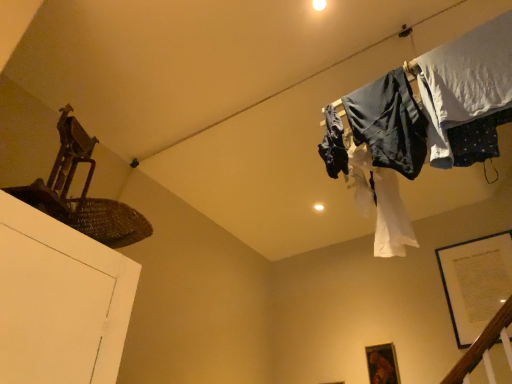
How much space does dark blue fabric at upper right, the second clothing when ordered from right to left, occupy horizontally?

dark blue fabric at upper right, the second clothing when ordered from right to left, is 4.74 inches in width.

Where is `dark blue fabric at upper right, the 2th clothing positioned from the left`? dark blue fabric at upper right, the 2th clothing positioned from the left is located at coordinates (389, 123).

What do you see at coordinates (333, 144) in the screenshot? I see `dark blue fabric at upper right, acting as the first clothing starting from the left` at bounding box center [333, 144].

The width and height of the screenshot is (512, 384). What do you see at coordinates (467, 81) in the screenshot?
I see `white fabric at upper right, arranged as the first clothing when viewed from the right` at bounding box center [467, 81].

Identify the location of dark blue fabric at upper right, the second clothing when ordered from right to left. The height and width of the screenshot is (384, 512). (389, 123).

Is dark blue fabric at upper right, acting as the first clothing starting from the left, surrounded by wooden frame at lower right?

Actually, dark blue fabric at upper right, acting as the first clothing starting from the left, is outside wooden frame at lower right.

Locate an element on the screen. The height and width of the screenshot is (384, 512). picture frame below the dark blue fabric at upper right, acting as the first clothing starting from the left (from a real-world perspective) is located at coordinates (382, 364).

Between wooden frame at lower right and dark blue fabric at upper right, acting as the first clothing starting from the left, which one has more height?

wooden frame at lower right.

Is there a large distance between wooden frame at lower right and dark blue fabric at upper right, acting as the first clothing starting from the left?

That's right, there is a large distance between wooden frame at lower right and dark blue fabric at upper right, acting as the first clothing starting from the left.

Does wooden frame at lower right appear on the left side of white fabric at upper right, arranged as the first clothing when viewed from the right?

Incorrect, wooden frame at lower right is not on the left side of white fabric at upper right, arranged as the first clothing when viewed from the right.

Is wooden frame at lower right shorter than white fabric at upper right, arranged as the first clothing when viewed from the right?

Indeed, wooden frame at lower right has a lesser height compared to white fabric at upper right, arranged as the first clothing when viewed from the right.

Between wooden frame at lower right and white fabric at upper right, arranged as the first clothing when viewed from the right, which one has smaller size?

With smaller size is wooden frame at lower right.

Does wooden frame at lower right come behind white fabric at upper right, arranged as the first clothing when viewed from the right?

Yes, wooden frame at lower right is behind white fabric at upper right, arranged as the first clothing when viewed from the right.

Is dark blue fabric at upper right, the second clothing when ordered from right to left, smaller than wooden frame at lower right?

Incorrect, dark blue fabric at upper right, the second clothing when ordered from right to left, is not smaller in size than wooden frame at lower right.

Is point (369, 110) closer to viewer compared to point (386, 373)?

That is True.

From a real-world perspective, which is physically above, dark blue fabric at upper right, the 2th clothing positioned from the left, or wooden frame at lower right?

In real-world perspective, dark blue fabric at upper right, the 2th clothing positioned from the left, is above.

How many degrees apart are the facing directions of dark blue fabric at upper right, the second clothing when ordered from right to left, and wooden frame at lower right?

They differ by 0.533 degrees in their facing directions.

Looking at this image, considering the relative positions of dark blue fabric at upper right, acting as the first clothing starting from the left, and dark blue fabric at upper right, the 2th clothing positioned from the left, in the image provided, is dark blue fabric at upper right, acting as the first clothing starting from the left, behind dark blue fabric at upper right, the 2th clothing positioned from the left,?

Yes, the depth of dark blue fabric at upper right, acting as the first clothing starting from the left, is greater than that of dark blue fabric at upper right, the 2th clothing positioned from the left.

Which of these two, dark blue fabric at upper right, which ranks as the 3th clothing in right-to-left order, or dark blue fabric at upper right, the second clothing when ordered from right to left, stands taller?

dark blue fabric at upper right, the second clothing when ordered from right to left.

Which of these two, dark blue fabric at upper right, which ranks as the 3th clothing in right-to-left order, or dark blue fabric at upper right, the 2th clothing positioned from the left, is bigger?

dark blue fabric at upper right, the 2th clothing positioned from the left.

How much distance is there between dark blue fabric at upper right, which ranks as the 3th clothing in right-to-left order, and dark blue fabric at upper right, the 2th clothing positioned from the left?

A distance of 6.79 inches exists between dark blue fabric at upper right, which ranks as the 3th clothing in right-to-left order, and dark blue fabric at upper right, the 2th clothing positioned from the left.

Is dark blue fabric at upper right, which ranks as the 3th clothing in right-to-left order, oriented towards white fabric at upper right, arranged as the first clothing when viewed from the right?

No, dark blue fabric at upper right, which ranks as the 3th clothing in right-to-left order, is not turned towards white fabric at upper right, arranged as the first clothing when viewed from the right.

How distant is dark blue fabric at upper right, which ranks as the 3th clothing in right-to-left order, from white fabric at upper right, the 3th clothing in the left-to-right sequence?

The distance of dark blue fabric at upper right, which ranks as the 3th clothing in right-to-left order, from white fabric at upper right, the 3th clothing in the left-to-right sequence, is 17.81 inches.

From a real-world perspective, who is located lower, dark blue fabric at upper right, which ranks as the 3th clothing in right-to-left order, or white fabric at upper right, arranged as the first clothing when viewed from the right?

white fabric at upper right, arranged as the first clothing when viewed from the right, from a real-world perspective.

Does dark blue fabric at upper right, which ranks as the 3th clothing in right-to-left order, touch white fabric at upper right, arranged as the first clothing when viewed from the right?

No, dark blue fabric at upper right, which ranks as the 3th clothing in right-to-left order, is not making contact with white fabric at upper right, arranged as the first clothing when viewed from the right.

From the image's perspective, would you say white fabric at upper right, the 3th clothing in the left-to-right sequence, is positioned over wooden frame at lower right?

Yes, from the image's perspective, white fabric at upper right, the 3th clothing in the left-to-right sequence, is on top of wooden frame at lower right.

In the image, is white fabric at upper right, arranged as the first clothing when viewed from the right, positioned in front of or behind wooden frame at lower right?

white fabric at upper right, arranged as the first clothing when viewed from the right, is positioned closer to the viewer than wooden frame at lower right.

Is white fabric at upper right, arranged as the first clothing when viewed from the right, located outside wooden frame at lower right?

Yes, white fabric at upper right, arranged as the first clothing when viewed from the right, is located beyond the bounds of wooden frame at lower right.

Relative to dark blue fabric at upper right, which ranks as the 3th clothing in right-to-left order, is white fabric at upper right, the 3th clothing in the left-to-right sequence, in front or behind?

In the image, white fabric at upper right, the 3th clothing in the left-to-right sequence, appears in front of dark blue fabric at upper right, which ranks as the 3th clothing in right-to-left order.

This screenshot has width=512, height=384. I want to click on the 2nd clothing above the dark blue fabric at upper right, which ranks as the 3th clothing in right-to-left order (from the image's perspective), so click(467, 81).

Between white fabric at upper right, the 3th clothing in the left-to-right sequence, and dark blue fabric at upper right, acting as the first clothing starting from the left, which one has more height?

white fabric at upper right, the 3th clothing in the left-to-right sequence.

Visually, is white fabric at upper right, arranged as the first clothing when viewed from the right, positioned to the left or to the right of dark blue fabric at upper right, acting as the first clothing starting from the left?

Clearly, white fabric at upper right, arranged as the first clothing when viewed from the right, is on the right of dark blue fabric at upper right, acting as the first clothing starting from the left, in the image.

From a real-world perspective, which clothing is the 3rd one above the wooden frame at lower right? Please provide its 2D coordinates.

[(333, 144)]

At what (x,y) coordinates should I click in order to perform the action: click on the 1st clothing to the left of the wooden frame at lower right, starting your count from the anchor. Please return your answer as a coordinate pair (x, y). Image resolution: width=512 pixels, height=384 pixels. Looking at the image, I should click on (467, 81).

Estimate the real-world distances between objects in this image. Which object is closer to white fabric at upper right, the 3th clothing in the left-to-right sequence, dark blue fabric at upper right, which ranks as the 3th clothing in right-to-left order, or dark blue fabric at upper right, the 2th clothing positioned from the left?

Among the two, dark blue fabric at upper right, the 2th clothing positioned from the left, is located nearer to white fabric at upper right, the 3th clothing in the left-to-right sequence.

Considering their positions, is dark blue fabric at upper right, which ranks as the 3th clothing in right-to-left order, positioned closer to white fabric at upper right, the 3th clothing in the left-to-right sequence, than wooden frame at lower right?

Among the two, dark blue fabric at upper right, which ranks as the 3th clothing in right-to-left order, is located nearer to white fabric at upper right, the 3th clothing in the left-to-right sequence.

Considering their positions, is dark blue fabric at upper right, the 2th clothing positioned from the left, positioned closer to white fabric at upper right, the 3th clothing in the left-to-right sequence, than dark blue fabric at upper right, acting as the first clothing starting from the left?

Based on the image, dark blue fabric at upper right, the 2th clothing positioned from the left, appears to be nearer to white fabric at upper right, the 3th clothing in the left-to-right sequence.

Considering their positions, is white fabric at upper right, the 3th clothing in the left-to-right sequence, positioned further to wooden frame at lower right than dark blue fabric at upper right, the 2th clothing positioned from the left?

white fabric at upper right, the 3th clothing in the left-to-right sequence, lies further to wooden frame at lower right than the other object.

Estimate the real-world distances between objects in this image. Which object is further from white fabric at upper right, the 3th clothing in the left-to-right sequence, wooden frame at lower right or dark blue fabric at upper right, the 2th clothing positioned from the left?

Based on the image, wooden frame at lower right appears to be further to white fabric at upper right, the 3th clothing in the left-to-right sequence.

From the image, which object appears to be nearer to dark blue fabric at upper right, the second clothing when ordered from right to left, white fabric at upper right, arranged as the first clothing when viewed from the right, or dark blue fabric at upper right, which ranks as the 3th clothing in right-to-left order?

white fabric at upper right, arranged as the first clothing when viewed from the right, lies closer to dark blue fabric at upper right, the second clothing when ordered from right to left, than the other object.

From the image, which object appears to be farther from white fabric at upper right, the 3th clothing in the left-to-right sequence, dark blue fabric at upper right, the second clothing when ordered from right to left, or wooden frame at lower right?

Based on the image, wooden frame at lower right appears to be further to white fabric at upper right, the 3th clothing in the left-to-right sequence.

From the image, which object appears to be farther from dark blue fabric at upper right, acting as the first clothing starting from the left, wooden frame at lower right or dark blue fabric at upper right, the 2th clothing positioned from the left?

wooden frame at lower right lies further to dark blue fabric at upper right, acting as the first clothing starting from the left, than the other object.

Find the location of a particular element. This screenshot has width=512, height=384. clothing between dark blue fabric at upper right, the 2th clothing positioned from the left, and wooden frame at lower right in the up-down direction is located at coordinates (333, 144).

Where is `clothing located between white fabric at upper right, the 3th clothing in the left-to-right sequence, and dark blue fabric at upper right, which ranks as the 3th clothing in right-to-left order, in the depth direction`? This screenshot has height=384, width=512. clothing located between white fabric at upper right, the 3th clothing in the left-to-right sequence, and dark blue fabric at upper right, which ranks as the 3th clothing in right-to-left order, in the depth direction is located at coordinates (389, 123).